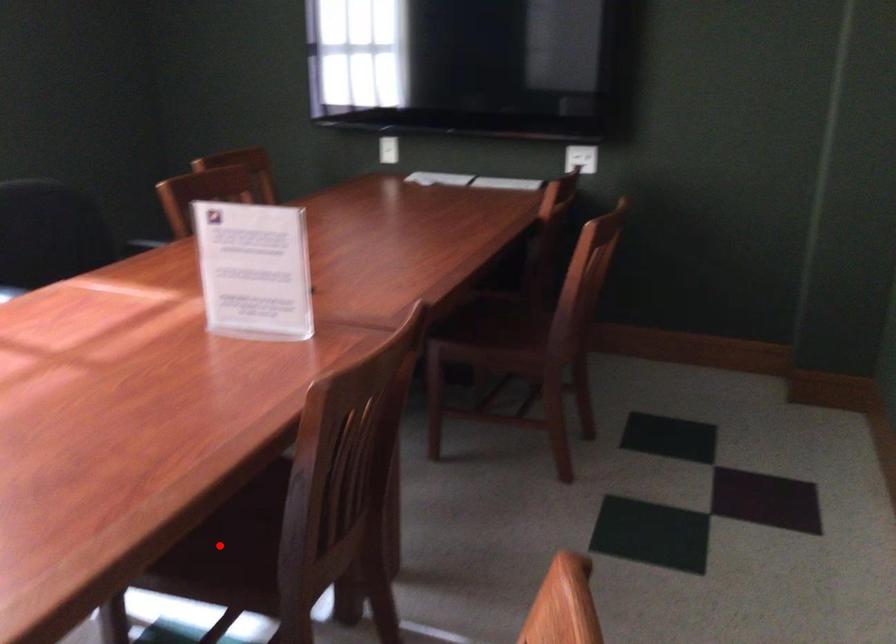
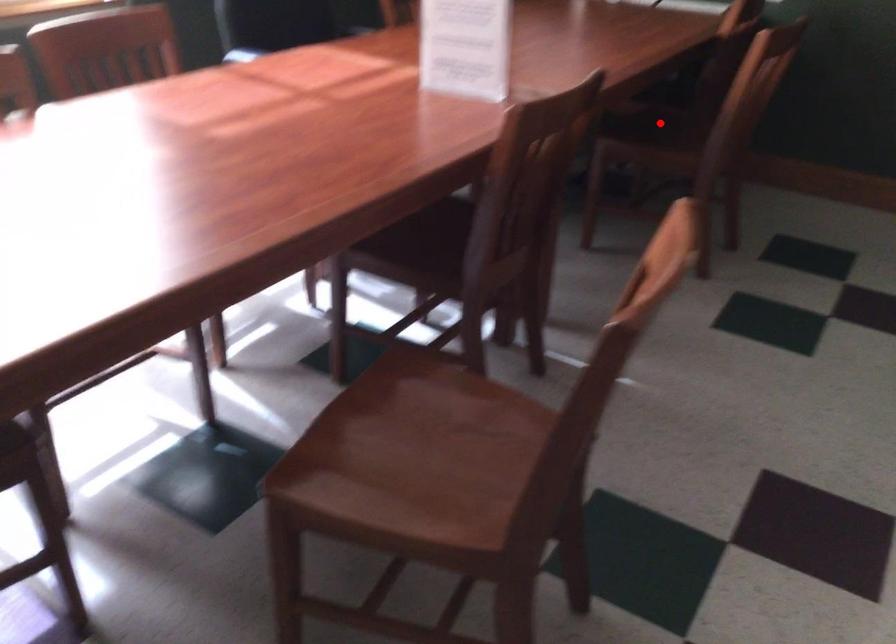
I am providing you with two images of the same scene from different viewpoints. A red point is marked on the first image and another point is marked on the second image. Is the red point in image1 aligned with the point shown in image2?

No